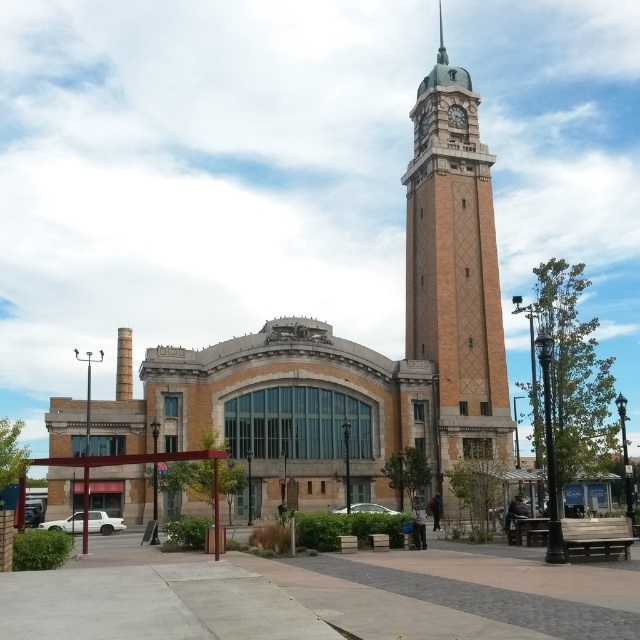
Does brown brick clock tower at upper right appear under brick clock tower at upper center?

Indeed, brown brick clock tower at upper right is positioned under brick clock tower at upper center.

In the scene shown: Between brown brick clock tower at upper right and brick clock tower at upper center, which one has less height?

Standing shorter between the two is brick clock tower at upper center.

Identify the location of brown brick clock tower at upper right. The width and height of the screenshot is (640, 640). coord(456,275).

Locate an element on the screen. The image size is (640, 640). brown brick clock tower at upper right is located at coordinates (456, 275).